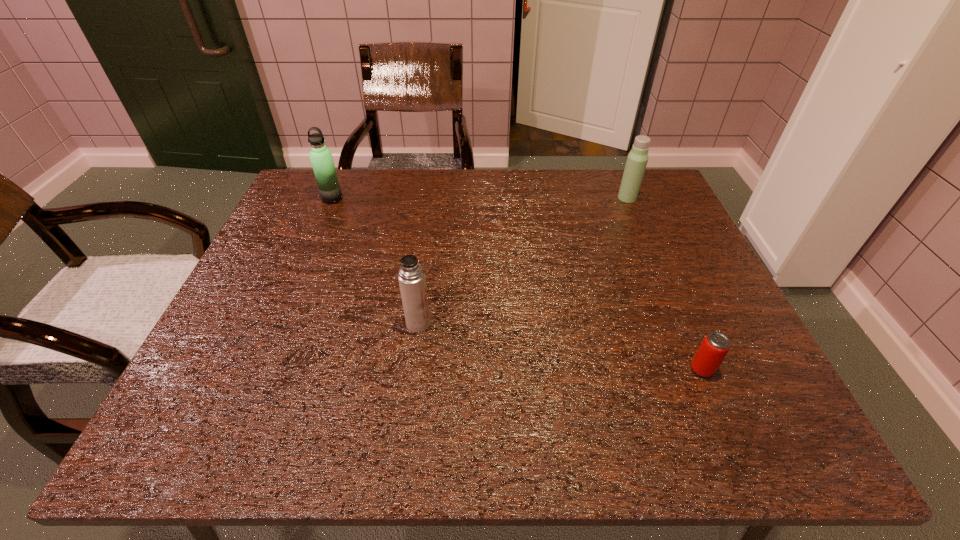
Identify the location of vacant region at the far edge of the desktop. (604, 186).

Where is `vacant space at the left edge of the desktop`? The height and width of the screenshot is (540, 960). vacant space at the left edge of the desktop is located at coordinates (276, 291).

The image size is (960, 540). What are the coordinates of `vacant space at the right edge of the desktop` in the screenshot? It's located at (692, 278).

Identify the location of vacant space at the far left corner of the desktop. Image resolution: width=960 pixels, height=540 pixels. (313, 179).

You are a GUI agent. You are given a task and a screenshot of the screen. Output one action in this format:
    pyautogui.click(x=<x>, y=<y>)
    Task: Click on the free region at the far right corner of the desktop
    Image resolution: width=960 pixels, height=540 pixels.
    Given the screenshot: What is the action you would take?
    pyautogui.click(x=667, y=183)

Where is `free space that is in between the alcohol and the octopus`? The width and height of the screenshot is (960, 540). free space that is in between the alcohol and the octopus is located at coordinates (480, 256).

Locate an element on the screen. Image resolution: width=960 pixels, height=540 pixels. free spot between the tallest object and the second tallest object is located at coordinates (654, 255).

The image size is (960, 540). I want to click on free space that is in between the alcohol and the third object from right to left, so point(587,187).

Locate an element on the screen. The width and height of the screenshot is (960, 540). blank region between the octopus and the alcohol is located at coordinates pos(480,256).

Where is `vacant area that lies between the bottle and the duckling`? Image resolution: width=960 pixels, height=540 pixels. vacant area that lies between the bottle and the duckling is located at coordinates pos(606,240).